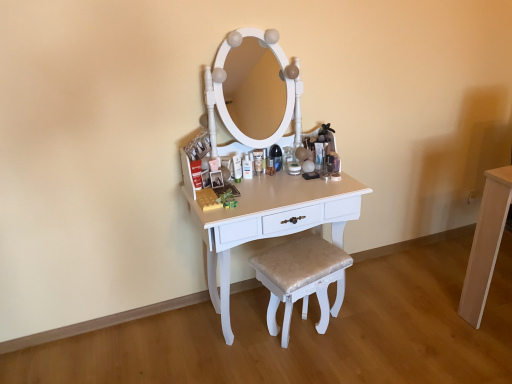
Where is `free space above shiny beige cushioned stool at center (from a real-world perspective)`? free space above shiny beige cushioned stool at center (from a real-world perspective) is located at coordinates (306, 258).